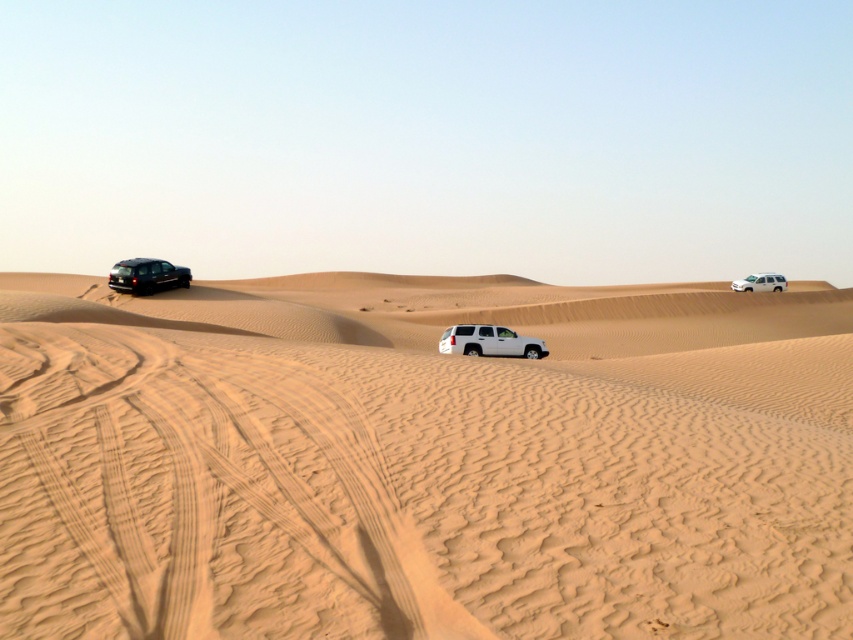
Is white matte suv at center to the right of shiny black suv at left from the viewer's perspective?

Yes, white matte suv at center is to the right of shiny black suv at left.

Locate an element on the screen. The image size is (853, 640). white matte suv at center is located at coordinates (489, 340).

The width and height of the screenshot is (853, 640). What are the coordinates of `white matte suv at center` in the screenshot? It's located at (489, 340).

Who is shorter, smooth golden sand at center or white matte suv at upper right?

Standing shorter between the two is white matte suv at upper right.

Is point (630, 340) positioned after point (775, 291)?

No, (630, 340) is in front of (775, 291).

Find the location of a particular element. Image resolution: width=853 pixels, height=640 pixels. smooth golden sand at center is located at coordinates (422, 460).

Does smooth golden sand at center appear over shiny black suv at left?

Actually, smooth golden sand at center is below shiny black suv at left.

Can you confirm if smooth golden sand at center is positioned to the left of shiny black suv at left?

In fact, smooth golden sand at center is to the right of shiny black suv at left.

Is point (485, 422) closer to camera compared to point (144, 260)?

That is True.

The image size is (853, 640). I want to click on smooth golden sand at center, so [422, 460].